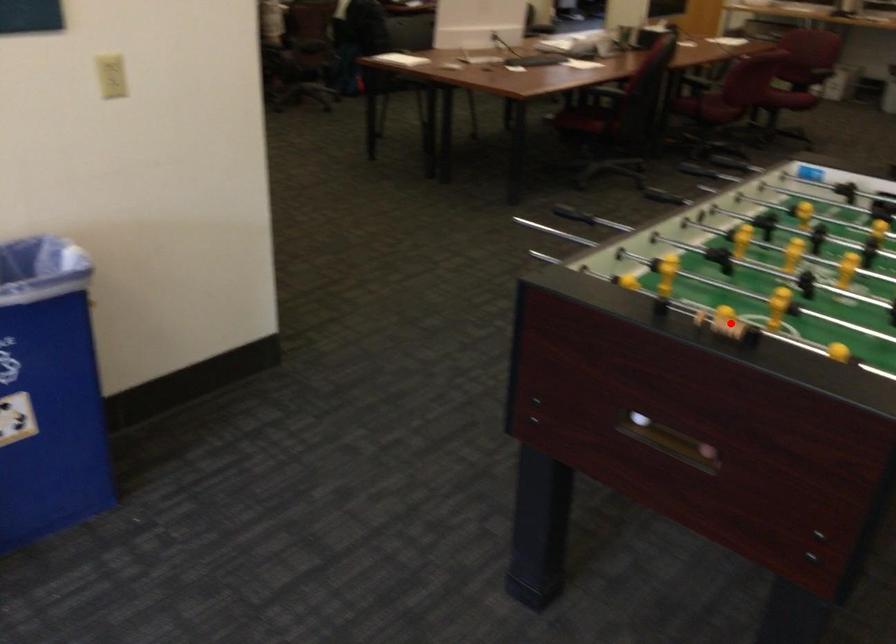
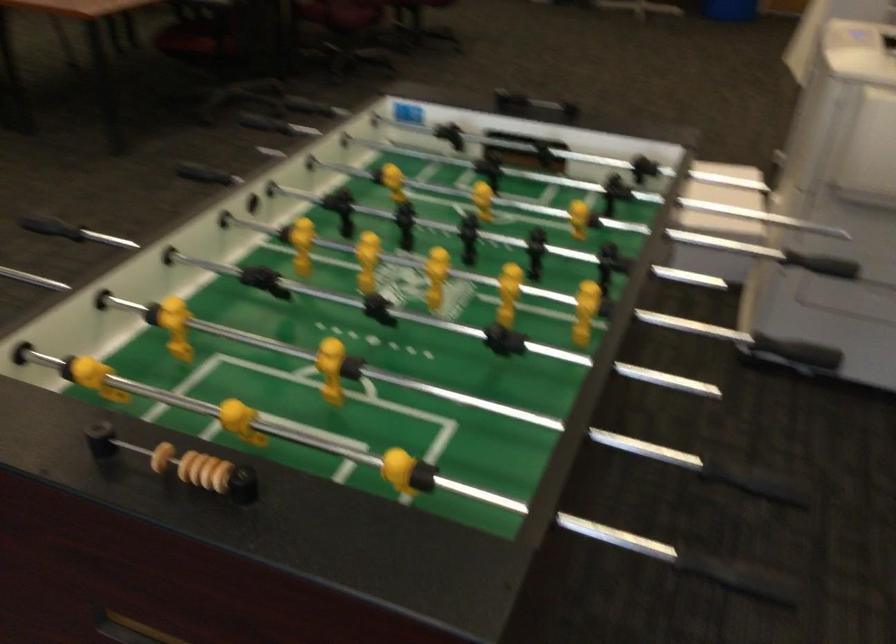
Locate, in the second image, the point that corresponds to the highlighted location in the first image.

(204, 471)